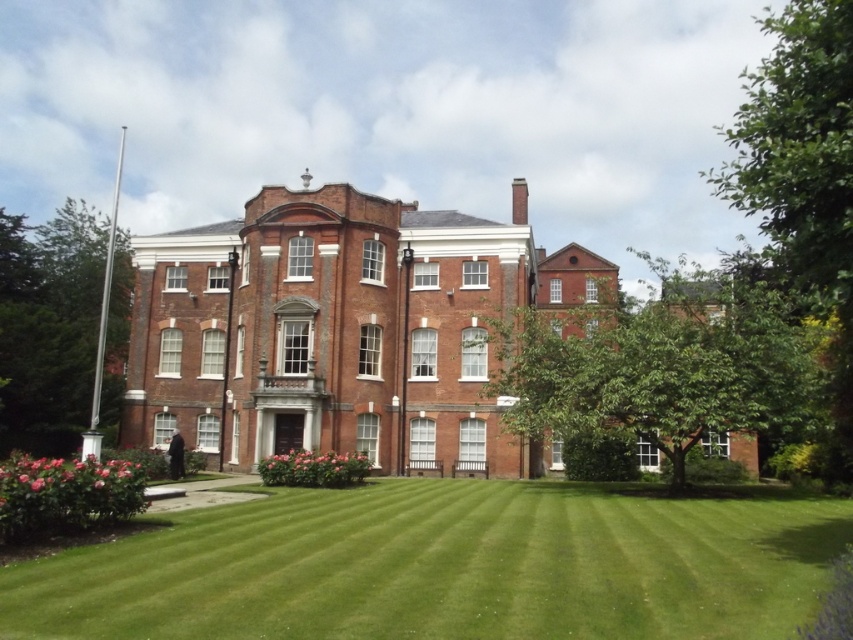
Consider the image. You are a landscape architect designing a new garden layout. You need to place a new statue exactly halfway between the brick mansion at center and the pink matte flowers at lower center. Which object will the statue be closer to, and why?

The statue will be closer to the brick mansion at center because the brick mansion at center is wider than the pink matte flowers at lower center, so the midpoint between them would be nearer to the mansion.

You are a gardener standing at the base of the green leafy tree at left. You need to water the brick mansion at center using a hose that can reach up to 30 meters. Can you water it without moving the hose reel?

The brick mansion at center is 29.75 meters away from the green leafy tree at left. Since the hose can reach up to 30 meters, you can water the brick mansion at center without moving the hose reel as the distance is within the hose length.

You are a gardener planning to plant new flowers near the brick mansion at center and the pink matte flowers at lower center. Based on their current positions, which object is located to the right of the other?

The brick mansion at center is positioned on the right side of pink matte flowers at lower center, so the brick mansion at center is to the right of the pink matte flowers at lower center.